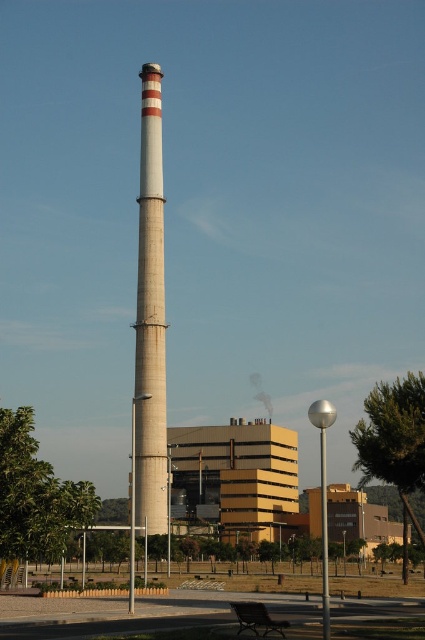
Does concrete chimney at center have a lesser width compared to wooden park bench at lower center?

Incorrect, concrete chimney at center's width is not less than wooden park bench at lower center's.

Which of these two, concrete chimney at center or wooden park bench at lower center, stands taller?

Standing taller between the two is concrete chimney at center.

Find the location of a particular element. This screenshot has height=640, width=425. concrete chimney at center is located at coordinates (150, 316).